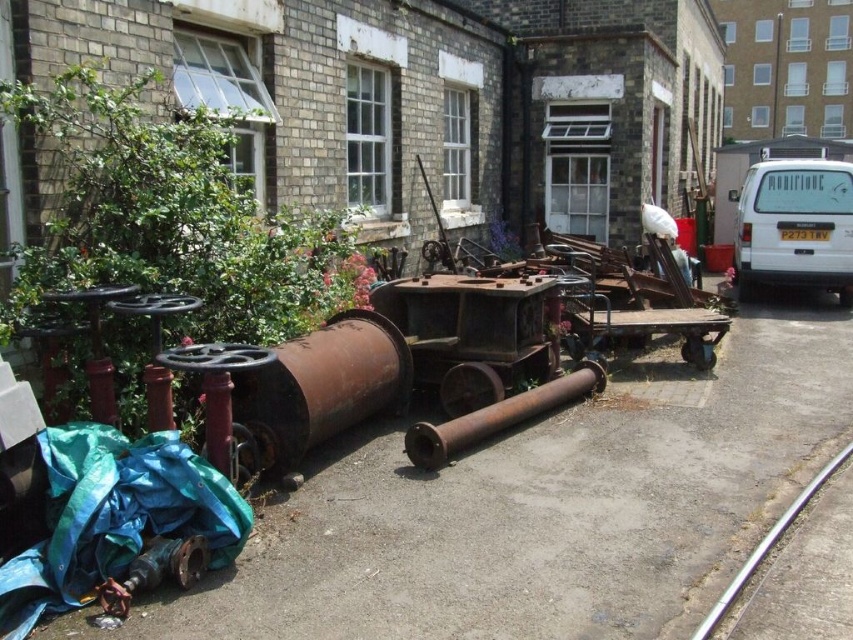
Question: Estimate the real-world distances between objects in this image. Which object is closer to the blue tarpaulin at lower left?

Choices:
 (A) silver metallic rail at lower right
 (B) rusty metal pipe at center
 (C) white matte van at upper right

Answer: (B)

Question: Does blue tarpaulin at lower left have a smaller size compared to silver metallic rail at lower right?

Choices:
 (A) yes
 (B) no

Answer: (A)

Question: Is blue tarpaulin at lower left bigger than silver metallic rail at lower right?

Choices:
 (A) no
 (B) yes

Answer: (A)

Question: Which point is closer to the camera?

Choices:
 (A) (808, 252)
 (B) (44, 564)

Answer: (B)

Question: Which object is closer to the camera taking this photo?

Choices:
 (A) white matte van at upper right
 (B) silver metallic rail at lower right

Answer: (B)

Question: Is white matte van at upper right above silver metallic rail at lower right?

Choices:
 (A) no
 (B) yes

Answer: (B)